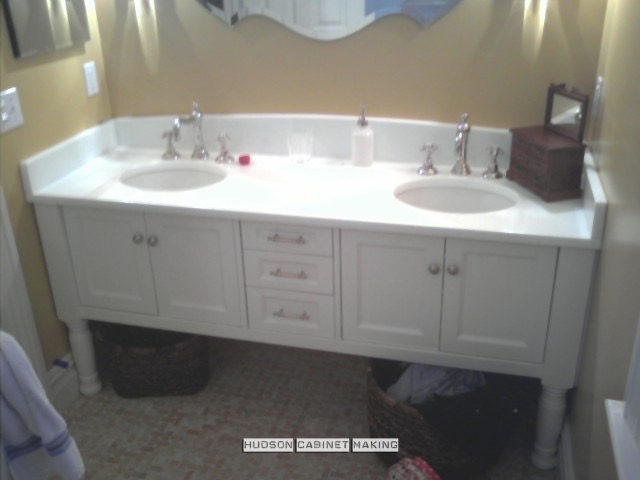
Locate an element on the screen. light switch is located at coordinates (6, 109).